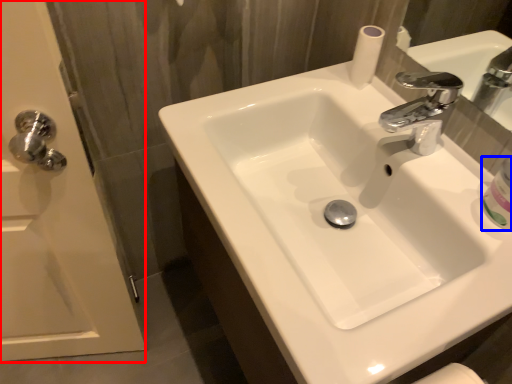
Question: Which of the following is the farthest to the observer, screen door (highlighted by a red box) or mouthwash (highlighted by a blue box)?

Choices:
 (A) screen door
 (B) mouthwash

Answer: (B)